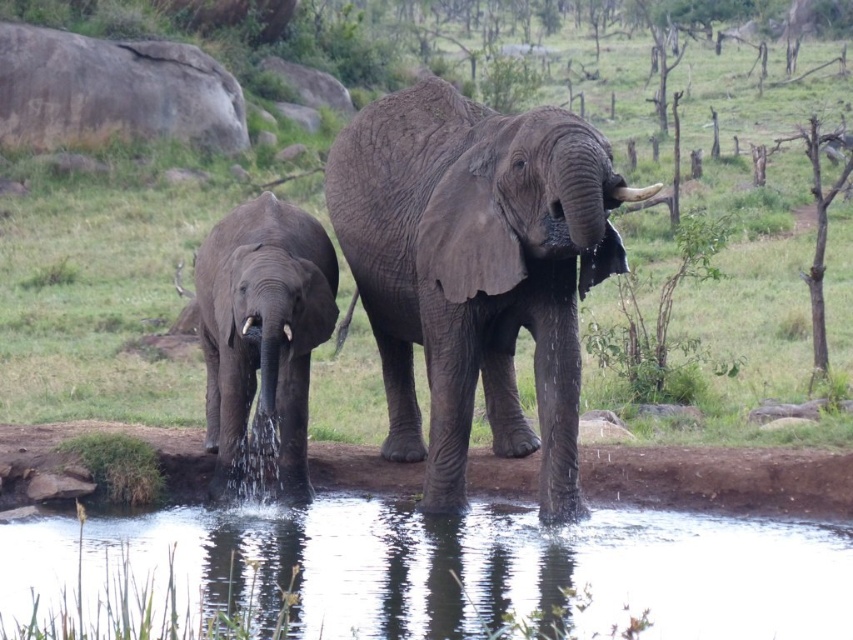
Question: Considering the real-world distances, which object is closest to the gray textured elephant at center?

Choices:
 (A) gray textured elephant at left
 (B) transparent liquid water at center
 (C) white ivory tusk at upper center

Answer: (A)

Question: Considering the real-world distances, which object is farthest from the transparent liquid water at center?

Choices:
 (A) gray textured elephant at center
 (B) white ivory tusk at upper center

Answer: (B)

Question: Does transparent liquid water at center appear under gray textured elephant at center?

Choices:
 (A) no
 (B) yes

Answer: (B)

Question: Can you confirm if transparent liquid water at center is positioned above gray textured elephant at center?

Choices:
 (A) no
 (B) yes

Answer: (A)

Question: Among these points, which one is nearest to the camera?

Choices:
 (A) (619, 198)
 (B) (497, 529)
 (C) (271, 384)

Answer: (A)

Question: Does transparent liquid water at center come in front of gray textured elephant at center?

Choices:
 (A) yes
 (B) no

Answer: (A)